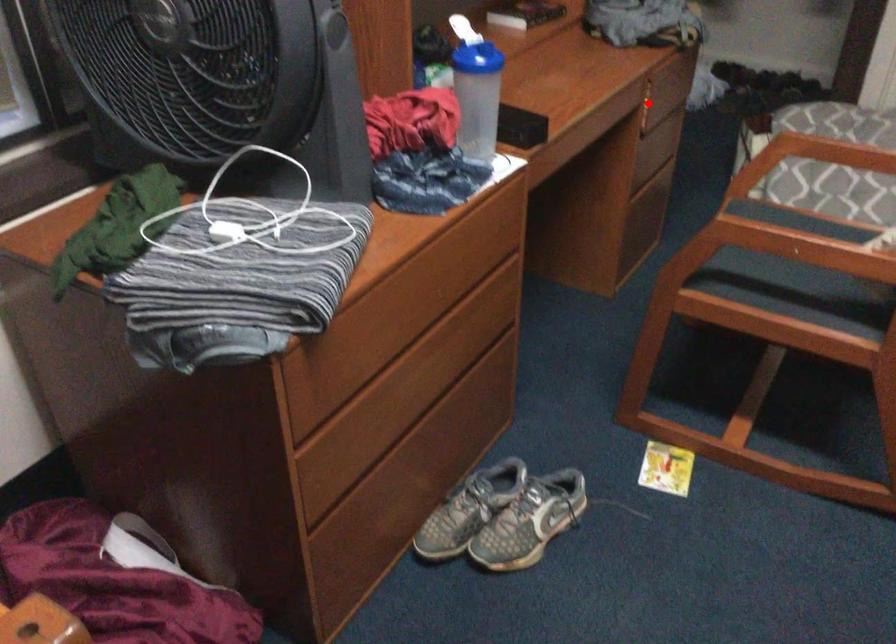
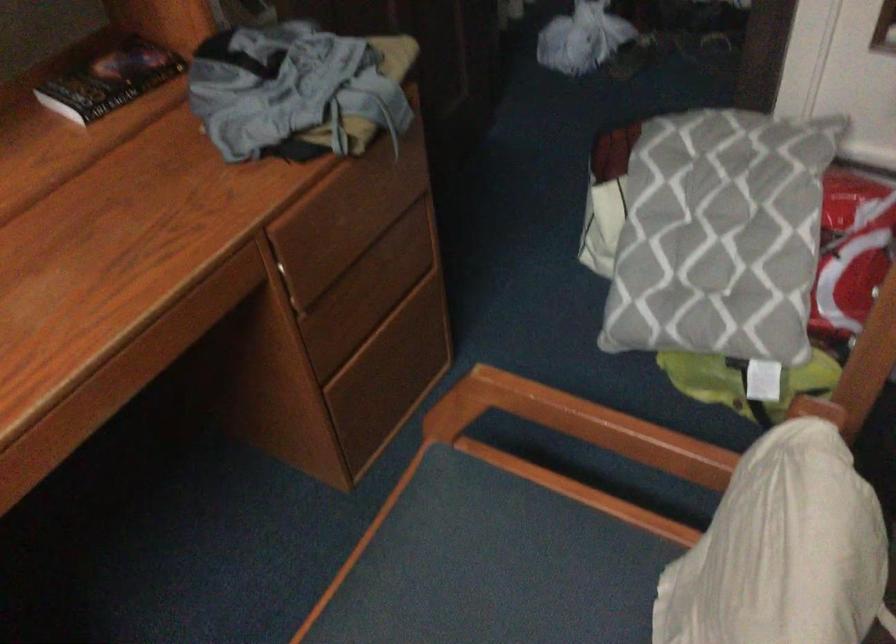
Question: I am providing you with two images of the same scene from different viewpoints. In image1, a red point is highlighted. Considering the same 3D point in image2, which of the following is correct?

Choices:
 (A) It is closer
 (B) It is farther

Answer: (A)